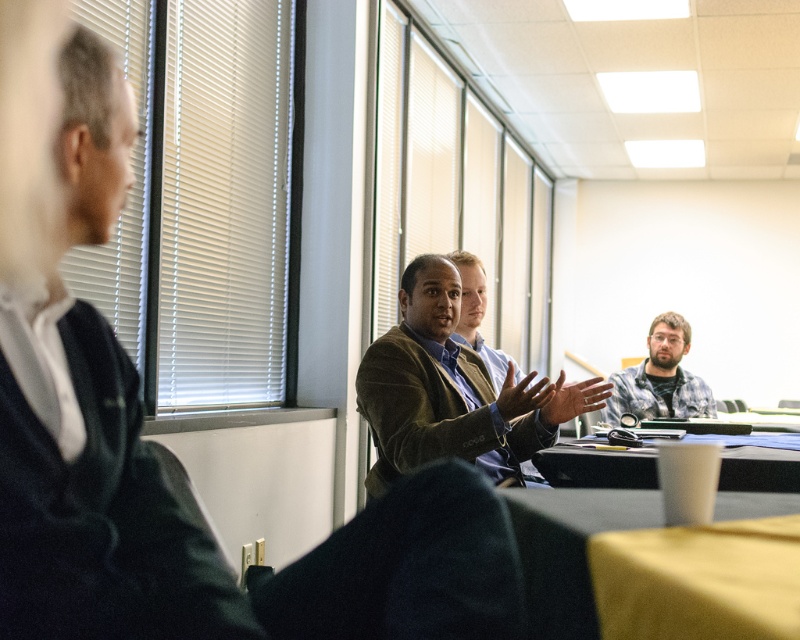
You are standing in the conference room and want to pick up an object. You see two points marked in the image. Which point is closer to you, point at coordinate (x=437, y=253) or point at coordinate (x=513, y=518)?

Point at coordinate (x=437, y=253) is further to the camera than point at coordinate (x=513, y=518), so the point at coordinate (x=513, y=518) is closer to you.